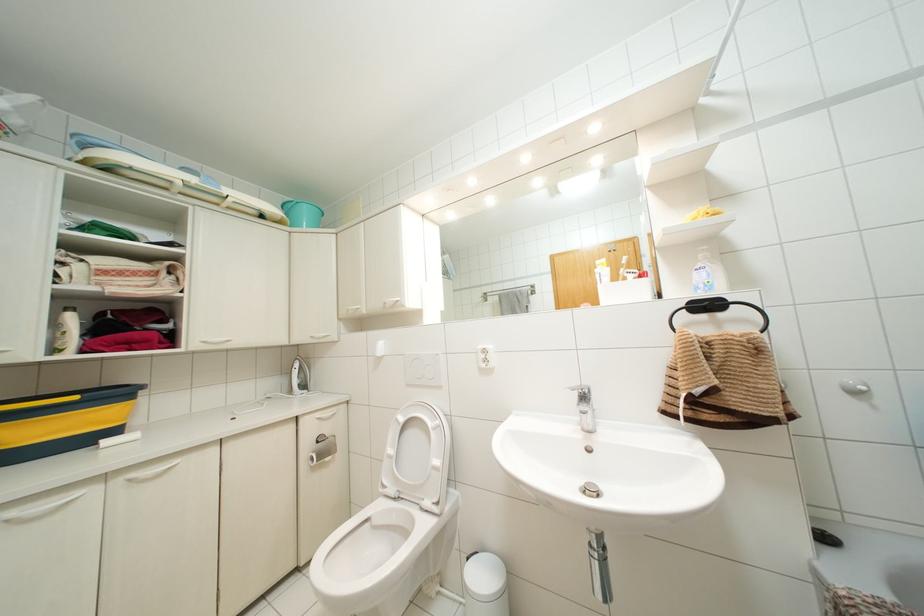
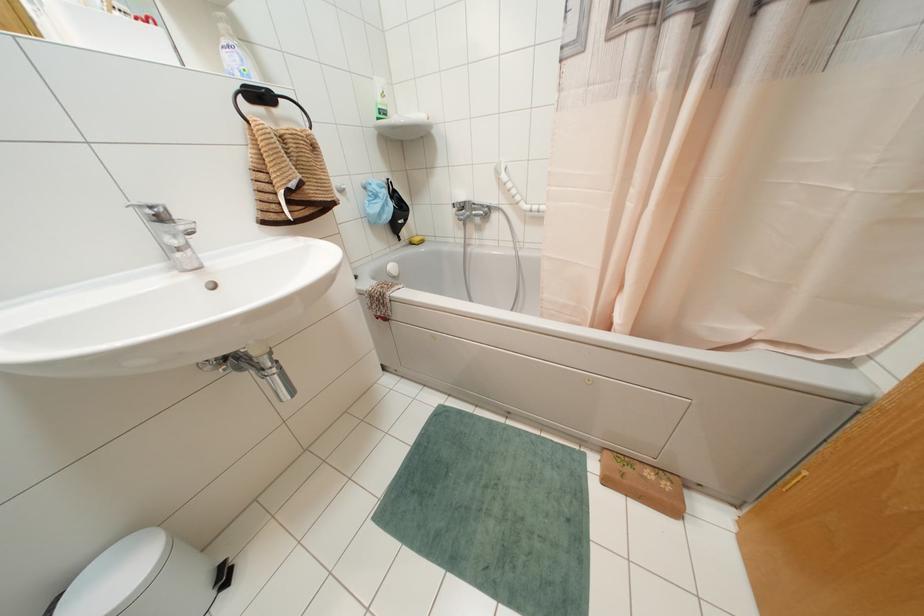
How did the camera likely rotate?

The camera rotated toward right-down.